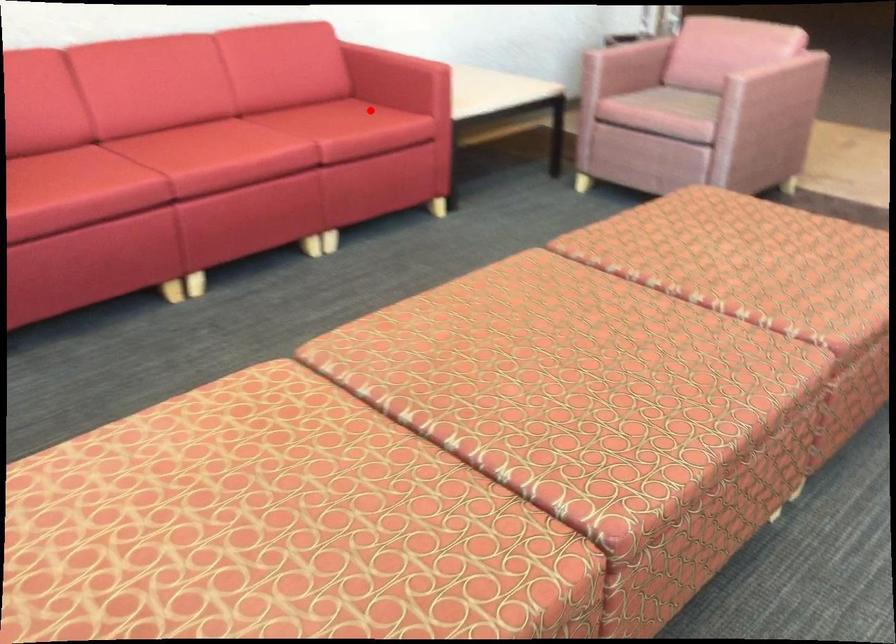
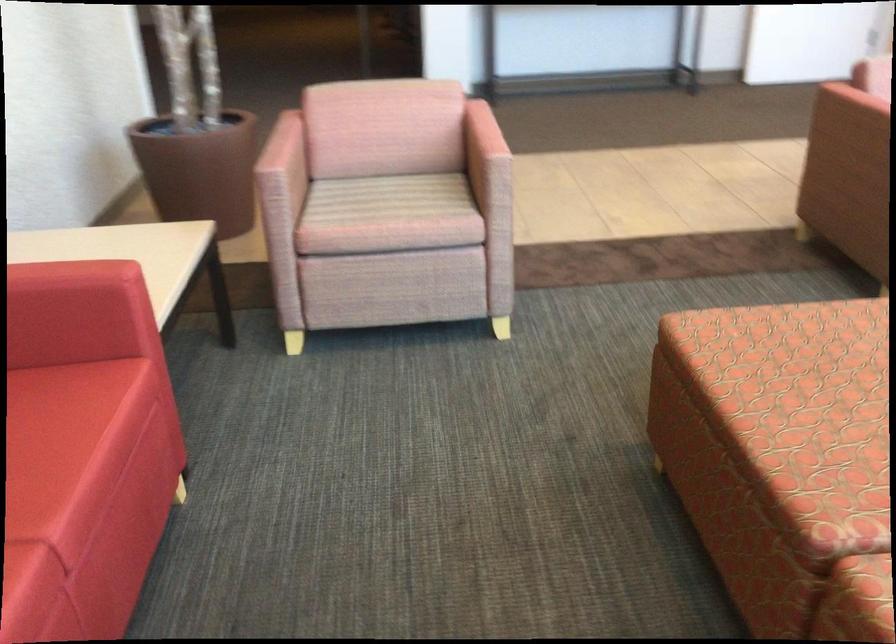
Question: I am providing you with two images of the same scene from different viewpoints. Image1 has a red point marked. In image2, the corresponding 3D location appears at what relative position? Reply with the corresponding letter.

Choices:
 (A) Closer
 (B) Farther

Answer: (A)